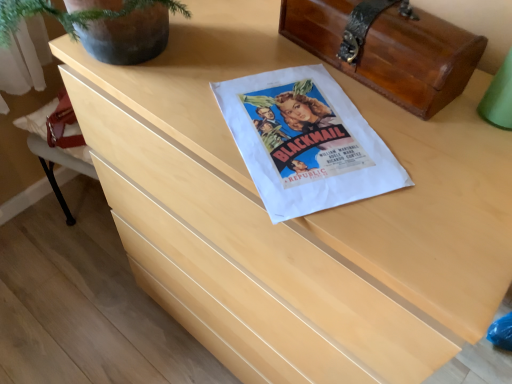
The height and width of the screenshot is (384, 512). Find the location of `vacant space behind white paper flyer at center`. vacant space behind white paper flyer at center is located at coordinates (259, 48).